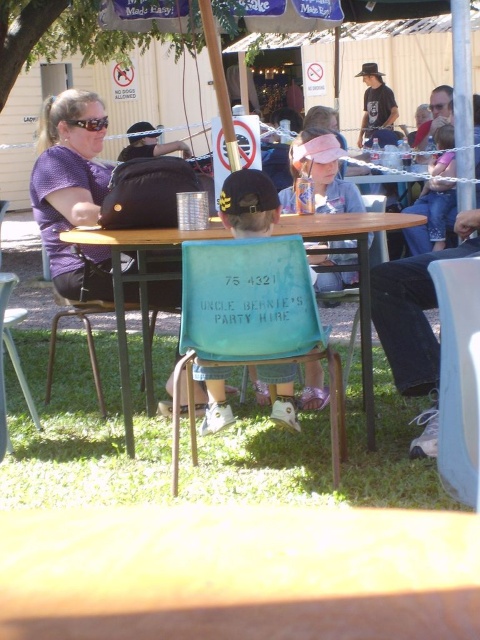
Question: Does teal plastic chair at center come behind blue plastic chair at lower right?

Choices:
 (A) yes
 (B) no

Answer: (A)

Question: Is teal plastic chair at center bigger than matte purple shirt at left?

Choices:
 (A) yes
 (B) no

Answer: (B)

Question: Estimate the real-world distances between objects in this image. Which object is farther from the teal plastic chair at center?

Choices:
 (A) matte purple shirt at left
 (B) wooden table at center

Answer: (A)

Question: Does teal plastic chair at center appear on the left side of matte purple shirt at left?

Choices:
 (A) yes
 (B) no

Answer: (B)

Question: Among these objects, which one is nearest to the camera?

Choices:
 (A) wooden table at center
 (B) blue plastic chair at lower right
 (C) teal plastic chair at center
 (D) matte purple shirt at left

Answer: (B)

Question: Which of these objects is positioned farthest from the blue plastic chair at lower right?

Choices:
 (A) wooden table at center
 (B) matte purple shirt at left
 (C) teal plastic chair at center

Answer: (B)